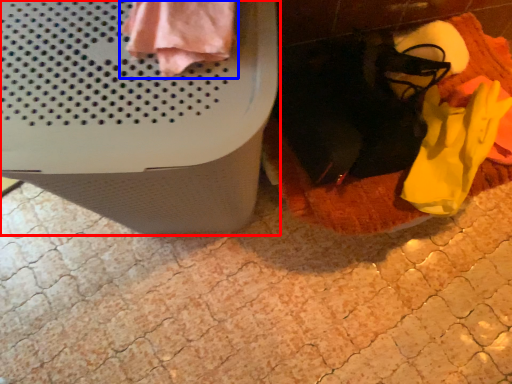
Question: Which point is closer to the camera, waste container (highlighted by a red box) or clothing (highlighted by a blue box)?

Choices:
 (A) waste container
 (B) clothing

Answer: (A)